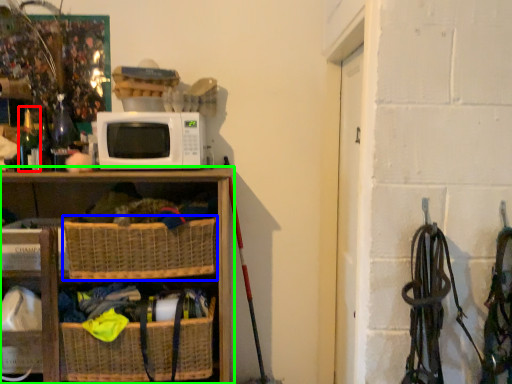
Question: Based on their relative distances, which object is farther from bottle (highlighted by a red box)? Choose from basket (highlighted by a blue box) and shelf (highlighted by a green box).

Choices:
 (A) basket
 (B) shelf

Answer: (A)